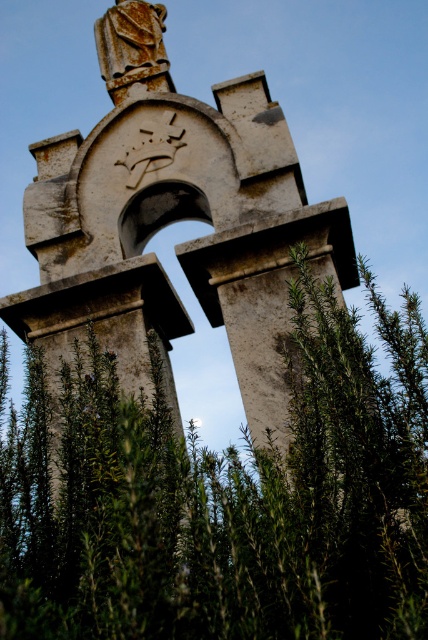
Question: Can you confirm if green leafy plant at center is wider than rusty stone arch at center?

Choices:
 (A) yes
 (B) no

Answer: (A)

Question: Which of the following is the farthest from the observer?

Choices:
 (A) rusty stone arch at center
 (B) green leafy plant at center

Answer: (A)

Question: Is the position of green leafy plant at center more distant than that of rusty stone arch at center?

Choices:
 (A) no
 (B) yes

Answer: (A)

Question: Is green leafy plant at center thinner than rusty stone arch at center?

Choices:
 (A) yes
 (B) no

Answer: (B)

Question: Which point is closer to the camera?

Choices:
 (A) (395, 449)
 (B) (163, 310)

Answer: (A)

Question: Which point is farther from the camera taking this photo?

Choices:
 (A) (136, 109)
 (B) (222, 525)

Answer: (A)